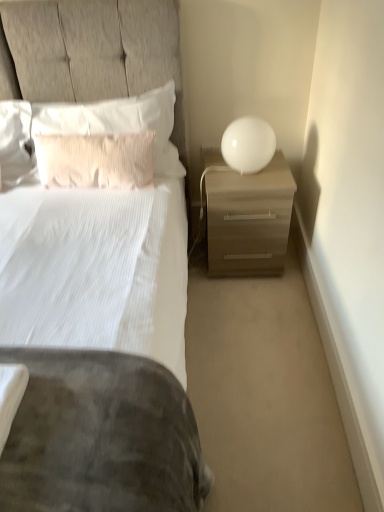
Question: From the image's perspective, would you say matte wood nightstand at right is shown under white glossy sphere at upper right?

Choices:
 (A) yes
 (B) no

Answer: (A)

Question: Considering the relative positions of matte wood nightstand at right and white glossy sphere at upper right in the image provided, is matte wood nightstand at right to the left of white glossy sphere at upper right from the viewer's perspective?

Choices:
 (A) yes
 (B) no

Answer: (B)

Question: Can white glossy sphere at upper right be found inside matte wood nightstand at right?

Choices:
 (A) yes
 (B) no

Answer: (B)

Question: From a real-world perspective, is matte wood nightstand at right under white glossy sphere at upper right?

Choices:
 (A) yes
 (B) no

Answer: (A)

Question: Does matte wood nightstand at right come behind white glossy sphere at upper right?

Choices:
 (A) no
 (B) yes

Answer: (B)

Question: Considering the relative sizes of matte wood nightstand at right and white glossy sphere at upper right in the image provided, is matte wood nightstand at right bigger than white glossy sphere at upper right?

Choices:
 (A) yes
 (B) no

Answer: (A)

Question: Can you confirm if pink textured pillow at upper left, which ranks as the first pillow in bottom-to-top order, is taller than white glossy sphere at upper right?

Choices:
 (A) yes
 (B) no

Answer: (A)

Question: Can you confirm if pink textured pillow at upper left, which is the second pillow in top-to-bottom order, is bigger than white glossy sphere at upper right?

Choices:
 (A) no
 (B) yes

Answer: (B)

Question: Is pink textured pillow at upper left, which ranks as the first pillow in bottom-to-top order, positioned far away from white glossy sphere at upper right?

Choices:
 (A) yes
 (B) no

Answer: (B)

Question: Considering the relative sizes of pink textured pillow at upper left, which is the second pillow in top-to-bottom order, and white glossy sphere at upper right in the image provided, is pink textured pillow at upper left, which is the second pillow in top-to-bottom order, smaller than white glossy sphere at upper right?

Choices:
 (A) no
 (B) yes

Answer: (A)

Question: Is pink textured pillow at upper left, which ranks as the first pillow in bottom-to-top order, closer to camera compared to white glossy sphere at upper right?

Choices:
 (A) no
 (B) yes

Answer: (B)

Question: Is pink textured pillow at upper left, which ranks as the first pillow in bottom-to-top order, oriented towards white glossy sphere at upper right?

Choices:
 (A) no
 (B) yes

Answer: (A)

Question: Is matte wood nightstand at right further to camera compared to white textured pillow at upper left, positioned as the first pillow in top-to-bottom order?

Choices:
 (A) no
 (B) yes

Answer: (B)